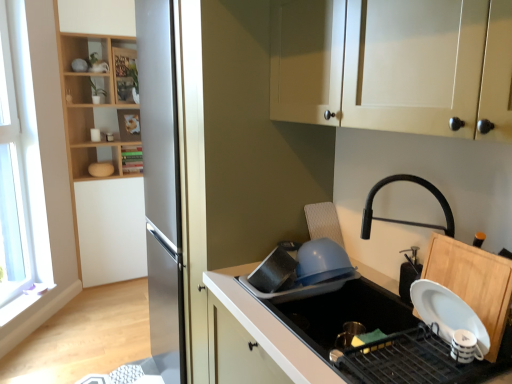
Question: Would you consider wooden bookshelf at upper left, which ranks as the 2th shelf in top-to-bottom order, to be distant from black matte soap dispenser at right, placed as the 2th appliance when sorted from left to right?

Choices:
 (A) no
 (B) yes

Answer: (B)

Question: Is wooden bookshelf at upper left, which ranks as the 2th shelf in top-to-bottom order, shorter than black matte soap dispenser at right, placed as the 2th appliance when sorted from left to right?

Choices:
 (A) yes
 (B) no

Answer: (B)

Question: From a real-world perspective, is wooden bookshelf at upper left, the 2th shelf from the bottom, on black matte soap dispenser at right, the 1th appliance positioned from the right?

Choices:
 (A) yes
 (B) no

Answer: (A)

Question: From a real-world perspective, is wooden bookshelf at upper left, the 2th shelf from the bottom, physically below black matte soap dispenser at right, the 1th appliance positioned from the right?

Choices:
 (A) yes
 (B) no

Answer: (B)

Question: Does wooden bookshelf at upper left, which ranks as the 2th shelf in top-to-bottom order, appear on the left side of black matte soap dispenser at right, placed as the 2th appliance when sorted from left to right?

Choices:
 (A) no
 (B) yes

Answer: (B)

Question: From the image's perspective, does wooden bookshelf at upper left, which ranks as the 2th shelf in top-to-bottom order, appear higher than black matte soap dispenser at right, placed as the 2th appliance when sorted from left to right?

Choices:
 (A) yes
 (B) no

Answer: (A)

Question: Is transparent glass window at left further to the viewer compared to black matte soap dispenser at right, the 1th appliance positioned from the right?

Choices:
 (A) yes
 (B) no

Answer: (A)

Question: Considering the relative sizes of transparent glass window at left and black matte soap dispenser at right, placed as the 2th appliance when sorted from left to right, in the image provided, is transparent glass window at left bigger than black matte soap dispenser at right, placed as the 2th appliance when sorted from left to right,?

Choices:
 (A) yes
 (B) no

Answer: (A)

Question: Considering the relative sizes of transparent glass window at left and black matte soap dispenser at right, the 1th appliance positioned from the right, in the image provided, is transparent glass window at left wider than black matte soap dispenser at right, the 1th appliance positioned from the right,?

Choices:
 (A) yes
 (B) no

Answer: (B)

Question: From a real-world perspective, is transparent glass window at left on black matte soap dispenser at right, the 1th appliance positioned from the right?

Choices:
 (A) yes
 (B) no

Answer: (A)

Question: Is transparent glass window at left to the left of black matte soap dispenser at right, placed as the 2th appliance when sorted from left to right, from the viewer's perspective?

Choices:
 (A) yes
 (B) no

Answer: (A)

Question: Is transparent glass window at left shorter than black matte soap dispenser at right, placed as the 2th appliance when sorted from left to right?

Choices:
 (A) no
 (B) yes

Answer: (A)

Question: From a real-world perspective, is white matte countertop at lower right located beneath black matte soap dispenser at right, the 1th appliance positioned from the right?

Choices:
 (A) no
 (B) yes

Answer: (B)